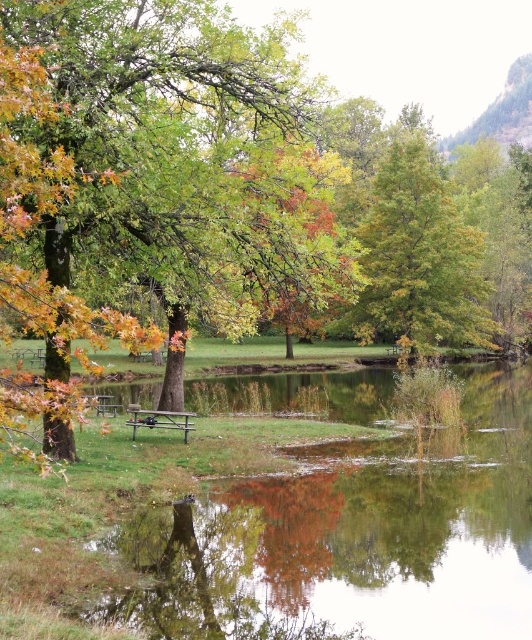
You are standing at the edge of the pond and want to take a photo of the green matte tree at center. According to the scene description, where should you position yourself to capture the tree in the center of your photo?

The green matte tree at center is located at point 0.395 on the x axis and 0.782 on the y axis. To capture it in the center of your photo, you should position yourself directly facing the coordinates [415,252].

You are planning to place a new bench in the autumnal scene by the pond. The current brown wooden bench at center is located where the green leafy tree at center is. If you move the bench to the spot where the tree is now, will it fit without overlapping the tree?

The green leafy tree at center is larger in size than the brown wooden bench at center. Moving the bench to the tree location would leave space since the bench is smaller, but the tree itself occupies the spot, so the bench cannot be placed there without overlapping.

You are standing at the edge of the pond and notice two points marked in the scene. The first point is at coordinate point (304, 176) and the second is at point (113, 416). Which point is closer to you?

Point (304, 176) is in front of point (113, 416), so it is closer to you.